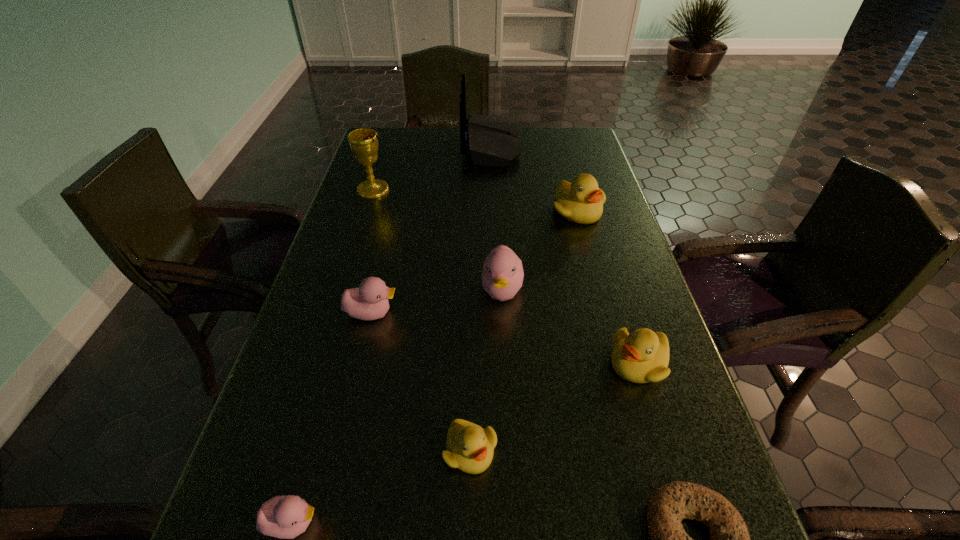
Find the location of a particular element. free space located on the front-facing side of the second nearest yellow duckling is located at coordinates (451, 363).

I want to click on vacant space situated on the front-facing side of the smallest yellow duckling, so click(468, 531).

At what (x,y) coordinates should I click in order to perform the action: click on object located at the far edge. Please return your answer as a coordinate pair (x, y). The width and height of the screenshot is (960, 540). Looking at the image, I should click on (491, 141).

Where is `chalice present at the left edge`? The width and height of the screenshot is (960, 540). chalice present at the left edge is located at coordinates (363, 142).

The image size is (960, 540). Find the location of `duckling positioned at the left edge`. duckling positioned at the left edge is located at coordinates (370, 301).

The image size is (960, 540). In the image, there is a desktop. What are the coordinates of `free space at the left edge` in the screenshot? It's located at (357, 170).

The width and height of the screenshot is (960, 540). In the image, there is a desktop. In order to click on vacant space at the right edge in this screenshot , I will do `click(652, 480)`.

The height and width of the screenshot is (540, 960). Find the location of `free space at the far right corner of the desktop`. free space at the far right corner of the desktop is located at coordinates (587, 146).

Locate an element on the screen. The image size is (960, 540). vacant region between the farthest object and the nearest yellow duckling is located at coordinates (481, 299).

Locate an element on the screen. This screenshot has height=540, width=960. vacant region between the second nearest yellow duckling and the router is located at coordinates click(x=564, y=255).